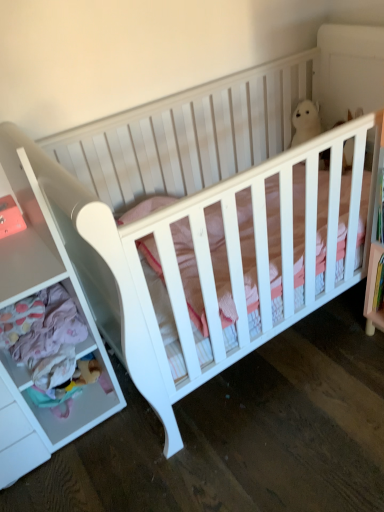
Question: Considering the relative sizes of soft plush bear at lower left and white plush bear at upper center in the image provided, is soft plush bear at lower left wider than white plush bear at upper center?

Choices:
 (A) yes
 (B) no

Answer: (B)

Question: Can you confirm if soft plush bear at lower left is taller than white plush bear at upper center?

Choices:
 (A) no
 (B) yes

Answer: (A)

Question: Does soft plush bear at lower left appear on the left side of white plush bear at upper center?

Choices:
 (A) no
 (B) yes

Answer: (B)

Question: From a real-world perspective, is soft plush bear at lower left over white plush bear at upper center?

Choices:
 (A) no
 (B) yes

Answer: (A)

Question: Is soft plush bear at lower left shorter than white plush bear at upper center?

Choices:
 (A) yes
 (B) no

Answer: (A)

Question: Is white plush bear at upper center at the back of soft plush bear at lower left?

Choices:
 (A) no
 (B) yes

Answer: (A)

Question: Is white matte drawer at left not near white plush bear at upper center?

Choices:
 (A) yes
 (B) no

Answer: (A)

Question: Does white matte drawer at left have a greater width compared to white plush bear at upper center?

Choices:
 (A) no
 (B) yes

Answer: (B)

Question: Is white matte drawer at left outside white plush bear at upper center?

Choices:
 (A) no
 (B) yes

Answer: (B)

Question: Is the depth of white matte drawer at left less than that of white plush bear at upper center?

Choices:
 (A) no
 (B) yes

Answer: (B)

Question: From the image's perspective, is white matte drawer at left above white plush bear at upper center?

Choices:
 (A) yes
 (B) no

Answer: (B)

Question: Is white matte drawer at left oriented away from white plush bear at upper center?

Choices:
 (A) no
 (B) yes

Answer: (A)

Question: Would you say soft plush bear at lower left contains white matte drawer at left?

Choices:
 (A) yes
 (B) no

Answer: (B)